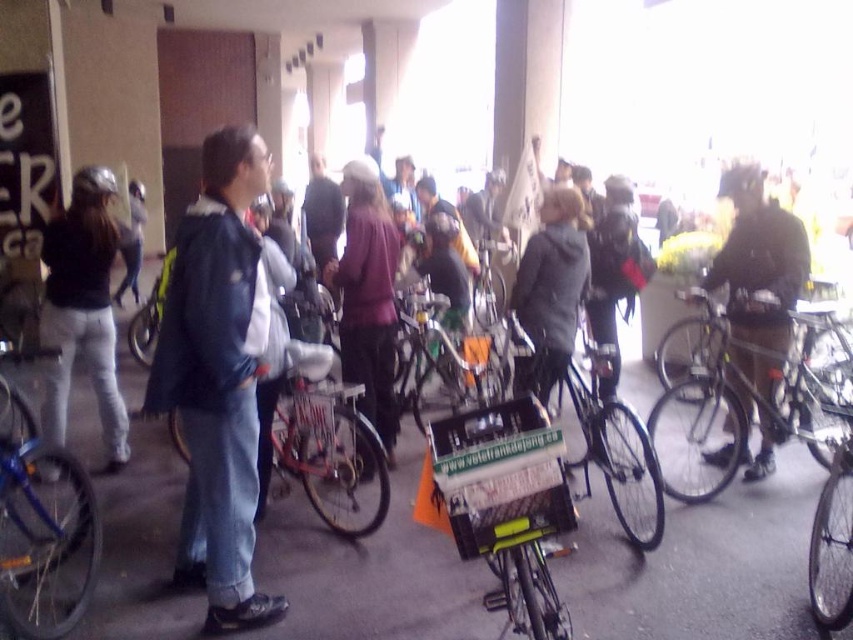
Question: From the image, what is the correct spatial relationship of shiny silver bicycle at right in relation to dark gray jacket at center?

Choices:
 (A) above
 (B) below

Answer: (B)

Question: Does denim jacket at center have a lesser width compared to dark gray helmet at right?

Choices:
 (A) yes
 (B) no

Answer: (B)

Question: Which of the following is the closest to the observer?

Choices:
 (A) shiny silver bicycle at right
 (B) shiny metallic bicycle at lower right

Answer: (B)

Question: Is shiny metallic bicycle at center smaller than dark gray jacket at center?

Choices:
 (A) yes
 (B) no

Answer: (B)

Question: Which point is closer to the camera?

Choices:
 (A) (676, 451)
 (B) (77, 572)
 (C) (607, 360)
 (D) (236, 240)

Answer: (D)

Question: Which point is farther to the camera?

Choices:
 (A) shiny metallic bicycle at lower right
 (B) dark gray helmet at right
 (C) denim jacket at center
 (D) blue matte bicycle at lower left

Answer: (B)